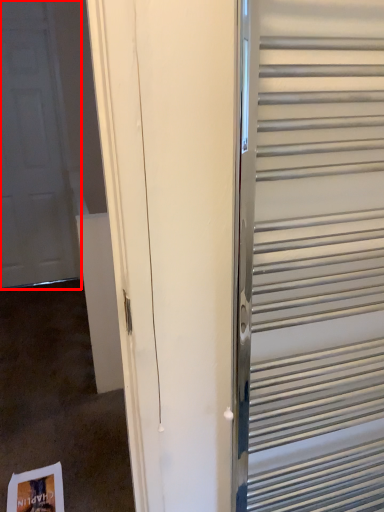
Question: From the image, what is the correct spatial relationship of door (annotated by the red box) in relation to elevator?

Choices:
 (A) left
 (B) right

Answer: (A)